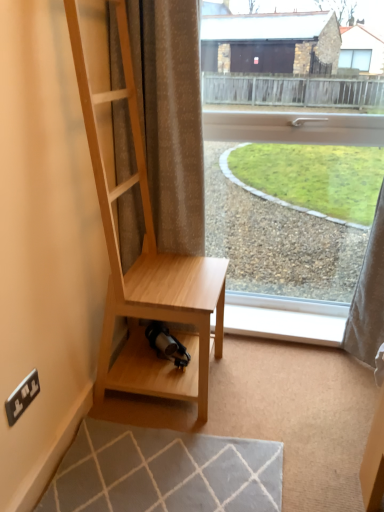
Question: Does transparent glass window at center have a larger size compared to light wood shelf at center?

Choices:
 (A) no
 (B) yes

Answer: (A)

Question: Does transparent glass window at center have a greater height compared to light wood shelf at center?

Choices:
 (A) no
 (B) yes

Answer: (B)

Question: Is the surface of transparent glass window at center in direct contact with light wood shelf at center?

Choices:
 (A) yes
 (B) no

Answer: (B)

Question: From the image's perspective, is transparent glass window at center under light wood shelf at center?

Choices:
 (A) no
 (B) yes

Answer: (A)

Question: Is transparent glass window at center positioned with its back to light wood shelf at center?

Choices:
 (A) yes
 (B) no

Answer: (B)

Question: Is transparent glass window at center wider than light wood shelf at center?

Choices:
 (A) yes
 (B) no

Answer: (B)

Question: From the image's perspective, is white plastic electric outlet at lower left located above transparent glass window at center?

Choices:
 (A) yes
 (B) no

Answer: (B)

Question: Does white plastic electric outlet at lower left have a smaller size compared to transparent glass window at center?

Choices:
 (A) no
 (B) yes

Answer: (B)

Question: From a real-world perspective, is white plastic electric outlet at lower left located higher than transparent glass window at center?

Choices:
 (A) yes
 (B) no

Answer: (B)

Question: Is transparent glass window at center completely or partially inside white plastic electric outlet at lower left?

Choices:
 (A) no
 (B) yes

Answer: (A)

Question: Is there a large distance between white plastic electric outlet at lower left and transparent glass window at center?

Choices:
 (A) yes
 (B) no

Answer: (A)

Question: Is white plastic electric outlet at lower left positioned in front of transparent glass window at center?

Choices:
 (A) yes
 (B) no

Answer: (A)

Question: Considering the relative sizes of light wood shelf at center and white plastic electric outlet at lower left in the image provided, is light wood shelf at center thinner than white plastic electric outlet at lower left?

Choices:
 (A) yes
 (B) no

Answer: (B)